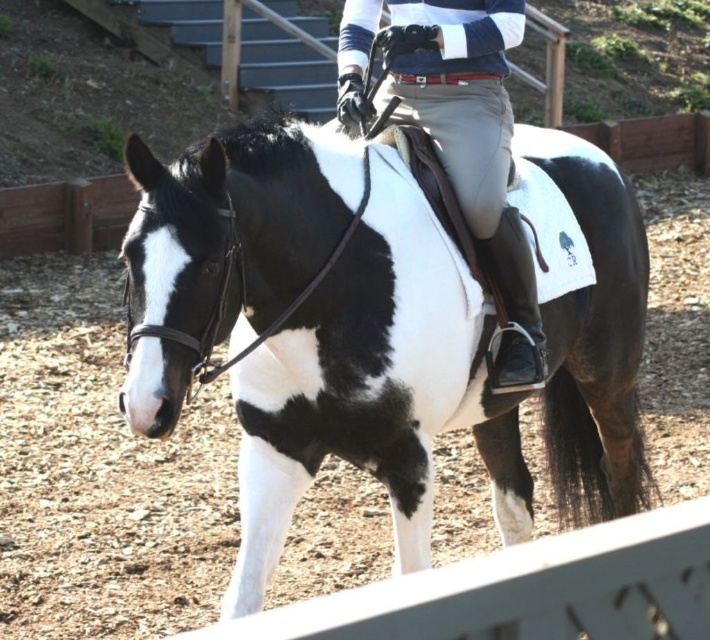
Looking at this image, you are a photographer standing at the edge of the arena. You want to take a photo of the light gray pants at center and the black and white speckled horse at center. Based on their positions, which object is closer to the right side of the photo?

The light gray pants at center is closer to the right side of the photo because the black and white speckled horse at center is to the left of light gray pants at center.

You are a photographer trying to capture a closeup of the rider while ensuring the horse remains in the background. Given the spatial relationship between the black and white speckled horse at center and the light gray pants at center, can you determine which object is wider and thus might require adjusting your camera angle to focus on the rider?

The black and white speckled horse at center is wider than the light gray pants at center, so adjusting the camera angle to focus on the rider might be necessary to ensure the horse doesn

You are a photographer positioned at the origin point of the image. You want to capture a closeup of the black and white speckled horse at center. Given that the horse is represented by the point at coordinates point (x=373, y=385), will you need to move your camera to the left or right to get a better shot?

A: The black and white speckled horse at center is represented by point (x=373, y=385), so the photographer does not need to move left or right since the horse is already centered in the image.